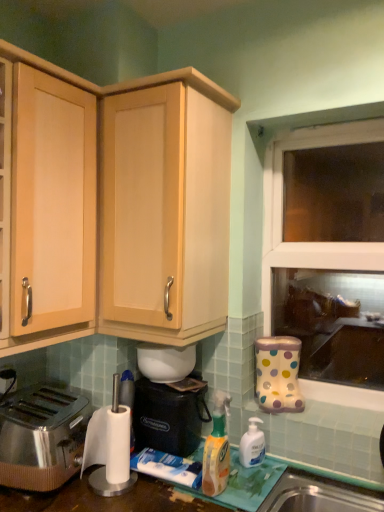
What do you see at coordinates (51, 205) in the screenshot?
I see `light wood cabinet at left, acting as the 2th cabinetry starting from the right` at bounding box center [51, 205].

Describe the element at coordinates (327, 249) in the screenshot. I see `transparent glass window at right` at that location.

Locate an element on the screen. black plastic trash can at lower center, the 2th appliance positioned from the top is located at coordinates point(169,415).

Describe the element at coordinates (217, 449) in the screenshot. The width and height of the screenshot is (384, 512). I see `translucent plastic spray bottle at lower center, which is counted as the first bottle, starting from the front` at that location.

Where is `white translucent pump bottle at lower center, which ranks as the first bottle in right-to-left order`? white translucent pump bottle at lower center, which ranks as the first bottle in right-to-left order is located at coordinates (252, 444).

The width and height of the screenshot is (384, 512). What are the coordinates of `white glossy bowl at center, placed as the first appliance when sorted from top to bottom` in the screenshot? It's located at (165, 362).

Is light wood cabinet at upper center, the first cabinetry in the right-to-left sequence, to the left or to the right of white translucent pump bottle at lower center, the 1th bottle viewed from the back, in the image?

From the image, it's evident that light wood cabinet at upper center, the first cabinetry in the right-to-left sequence, is to the left of white translucent pump bottle at lower center, the 1th bottle viewed from the back.

Is light wood cabinet at upper center, the first cabinetry in the right-to-left sequence, surrounding white translucent pump bottle at lower center, marked as the second bottle in a left-to-right arrangement?

No, white translucent pump bottle at lower center, marked as the second bottle in a left-to-right arrangement, is not a part of light wood cabinet at upper center, the first cabinetry in the right-to-left sequence.

Is light wood cabinet at upper center, the first cabinetry in the right-to-left sequence, turned away from white translucent pump bottle at lower center, the 2th bottle when ordered from front to back?

No, light wood cabinet at upper center, the first cabinetry in the right-to-left sequence,'s orientation is not away from white translucent pump bottle at lower center, the 2th bottle when ordered from front to back.

The width and height of the screenshot is (384, 512). In order to click on the 2nd bottle below the light wood cabinet at upper center, which appears as the 2th cabinetry when viewed from the left (from a real-world perspective) in this screenshot , I will do `click(252, 444)`.

From a real-world perspective, which is physically above, transparent glass window at right or black plastic trash can at lower center, the 2th appliance positioned from the top?

transparent glass window at right, from a real-world perspective.

Considering the sizes of objects transparent glass window at right and black plastic trash can at lower center, the 2th appliance positioned from the top, in the image provided, who is thinner, transparent glass window at right or black plastic trash can at lower center, the 2th appliance positioned from the top,?

Thinner between the two is transparent glass window at right.

Considering the relative sizes of transparent glass window at right and light wood cabinet at left, acting as the 2th cabinetry starting from the right, in the image provided, is transparent glass window at right thinner than light wood cabinet at left, acting as the 2th cabinetry starting from the right,?

Yes.

From the image's perspective, which object appears higher, transparent glass window at right or light wood cabinet at left, the 1th cabinetry viewed from the left?

light wood cabinet at left, the 1th cabinetry viewed from the left.

Would you say transparent glass window at right contains light wood cabinet at left, the 1th cabinetry viewed from the left?

No, transparent glass window at right does not contain light wood cabinet at left, the 1th cabinetry viewed from the left.

Is white glossy bowl at center, the second appliance in the bottom-to-top sequence, taller than white translucent pump bottle at lower center, the 1th bottle viewed from the back?

No, white glossy bowl at center, the second appliance in the bottom-to-top sequence, is not taller than white translucent pump bottle at lower center, the 1th bottle viewed from the back.

Is white glossy bowl at center, placed as the first appliance when sorted from top to bottom, wider than white translucent pump bottle at lower center, the 2th bottle when ordered from front to back?

Correct, the width of white glossy bowl at center, placed as the first appliance when sorted from top to bottom, exceeds that of white translucent pump bottle at lower center, the 2th bottle when ordered from front to back.

From the image's perspective, count 2nd bottles downward from the white glossy bowl at center, the second appliance in the bottom-to-top sequence, and point to it. Please provide its 2D coordinates.

[(252, 444)]

From a real-world perspective, is white glossy bowl at center, the second appliance in the bottom-to-top sequence, located beneath white translucent pump bottle at lower center, the 2th bottle when ordered from front to back?

No, from a real-world perspective, white glossy bowl at center, the second appliance in the bottom-to-top sequence, is not beneath white translucent pump bottle at lower center, the 2th bottle when ordered from front to back.

From a real-world perspective, is light wood cabinet at left, acting as the 2th cabinetry starting from the right, over black plastic trash can at lower center, acting as the 1th appliance starting from the bottom?

Indeed, from a real-world perspective, light wood cabinet at left, acting as the 2th cabinetry starting from the right, stands above black plastic trash can at lower center, acting as the 1th appliance starting from the bottom.

Looking at this image, is light wood cabinet at left, the 1th cabinetry viewed from the left, bigger than black plastic trash can at lower center, the 2th appliance positioned from the top?

Indeed, light wood cabinet at left, the 1th cabinetry viewed from the left, has a larger size compared to black plastic trash can at lower center, the 2th appliance positioned from the top.

Is light wood cabinet at left, acting as the 2th cabinetry starting from the right, taller than black plastic trash can at lower center, the 2th appliance positioned from the top?

Yes, light wood cabinet at left, acting as the 2th cabinetry starting from the right, is taller than black plastic trash can at lower center, the 2th appliance positioned from the top.

Considering the positions of objects light wood cabinet at left, acting as the 2th cabinetry starting from the right, and black plastic trash can at lower center, acting as the 1th appliance starting from the bottom, in the image provided, who is more to the right, light wood cabinet at left, acting as the 2th cabinetry starting from the right, or black plastic trash can at lower center, acting as the 1th appliance starting from the bottom,?

Positioned to the right is black plastic trash can at lower center, acting as the 1th appliance starting from the bottom.

Is white glossy bowl at center, placed as the first appliance when sorted from top to bottom, positioned with its back to black plastic trash can at lower center, the 2th appliance positioned from the top?

No.

Between white glossy bowl at center, placed as the first appliance when sorted from top to bottom, and black plastic trash can at lower center, acting as the 1th appliance starting from the bottom, which one has smaller size?

white glossy bowl at center, placed as the first appliance when sorted from top to bottom, is smaller.

Which is closer, (138, 348) or (177, 439)?

Point (138, 348).

I want to click on appliance below the white glossy bowl at center, the second appliance in the bottom-to-top sequence (from a real-world perspective), so click(169, 415).

Considering the positions of point (350, 138) and point (188, 362), is point (350, 138) closer or farther from the camera than point (188, 362)?

Point (350, 138) is positioned closer to the camera compared to point (188, 362).

Visually, is transparent glass window at right positioned to the left or to the right of white glossy bowl at center, placed as the first appliance when sorted from top to bottom?

From the image, it's evident that transparent glass window at right is to the right of white glossy bowl at center, placed as the first appliance when sorted from top to bottom.

From the image's perspective, is transparent glass window at right positioned above or below white glossy bowl at center, placed as the first appliance when sorted from top to bottom?

transparent glass window at right is above white glossy bowl at center, placed as the first appliance when sorted from top to bottom.

Looking at this image, is transparent glass window at right outside of white glossy bowl at center, placed as the first appliance when sorted from top to bottom?

Yes, transparent glass window at right is located beyond the bounds of white glossy bowl at center, placed as the first appliance when sorted from top to bottom.

From the image's perspective, starting from the light wood cabinet at upper center, the first cabinetry in the right-to-left sequence, which bottle is the 2nd one below? Please provide its 2D coordinates.

[(252, 444)]

Where is `the 2nd appliance in front when counting from the transparent glass window at right`? Image resolution: width=384 pixels, height=512 pixels. the 2nd appliance in front when counting from the transparent glass window at right is located at coordinates (169, 415).

Considering their positions, is white translucent pump bottle at lower center, the 1th bottle viewed from the back, positioned further to light wood cabinet at left, the 1th cabinetry viewed from the left, than translucent plastic spray bottle at lower center, placed as the 2th bottle when sorted from back to front?

Among the two, white translucent pump bottle at lower center, the 1th bottle viewed from the back, is located further to light wood cabinet at left, the 1th cabinetry viewed from the left.

Estimate the real-world distances between objects in this image. Which object is closer to light wood cabinet at left, acting as the 2th cabinetry starting from the right, polished stainless steel toaster at lower left or transparent glass window at right?

polished stainless steel toaster at lower left.

Considering their positions, is white glossy bowl at center, the second appliance in the bottom-to-top sequence, positioned closer to polished stainless steel toaster at lower left than light wood cabinet at left, the 1th cabinetry viewed from the left?

The object closer to polished stainless steel toaster at lower left is white glossy bowl at center, the second appliance in the bottom-to-top sequence.

Looking at the image, which one is located further to black plastic trash can at lower center, acting as the 1th appliance starting from the bottom, white translucent pump bottle at lower center, which ranks as the first bottle in right-to-left order, or white glossy bowl at center, placed as the first appliance when sorted from top to bottom?

The object further to black plastic trash can at lower center, acting as the 1th appliance starting from the bottom, is white translucent pump bottle at lower center, which ranks as the first bottle in right-to-left order.

Estimate the real-world distances between objects in this image. Which object is further from light wood cabinet at left, acting as the 2th cabinetry starting from the right, translucent plastic spray bottle at lower center, arranged as the 2th bottle when viewed from the right, or white glossy bowl at center, the second appliance in the bottom-to-top sequence?

translucent plastic spray bottle at lower center, arranged as the 2th bottle when viewed from the right, is further to light wood cabinet at left, acting as the 2th cabinetry starting from the right.

Looking at the image, which one is located further to translucent plastic spray bottle at lower center, placed as the 2th bottle when sorted from back to front, transparent glass window at right or light wood cabinet at upper center, which appears as the 2th cabinetry when viewed from the left?

transparent glass window at right is further to translucent plastic spray bottle at lower center, placed as the 2th bottle when sorted from back to front.

When comparing their distances from white translucent pump bottle at lower center, marked as the second bottle in a left-to-right arrangement, does polished stainless steel toaster at lower left or white glossy bowl at center, the second appliance in the bottom-to-top sequence, seem further?

polished stainless steel toaster at lower left is further to white translucent pump bottle at lower center, marked as the second bottle in a left-to-right arrangement.

When comparing their distances from light wood cabinet at left, acting as the 2th cabinetry starting from the right, does polished stainless steel toaster at lower left or light wood cabinet at upper center, which appears as the 2th cabinetry when viewed from the left, seem closer?

The object closer to light wood cabinet at left, acting as the 2th cabinetry starting from the right, is light wood cabinet at upper center, which appears as the 2th cabinetry when viewed from the left.

Find the location of a particular element. This screenshot has width=384, height=512. cabinetry between light wood cabinet at left, the 1th cabinetry viewed from the left, and white glossy bowl at center, the second appliance in the bottom-to-top sequence, vertically is located at coordinates (126, 81).

This screenshot has width=384, height=512. I want to click on cabinetry between light wood cabinet at left, acting as the 2th cabinetry starting from the right, and white translucent pump bottle at lower center, which ranks as the first bottle in right-to-left order, in the up-down direction, so click(x=126, y=81).

I want to click on bottle between polished stainless steel toaster at lower left and white translucent pump bottle at lower center, the 2th bottle when ordered from front to back, from left to right, so click(217, 449).

Where is `toaster between light wood cabinet at left, acting as the 2th cabinetry starting from the right, and transparent glass window at right, in the horizontal direction`? The height and width of the screenshot is (512, 384). toaster between light wood cabinet at left, acting as the 2th cabinetry starting from the right, and transparent glass window at right, in the horizontal direction is located at coordinates (42, 436).